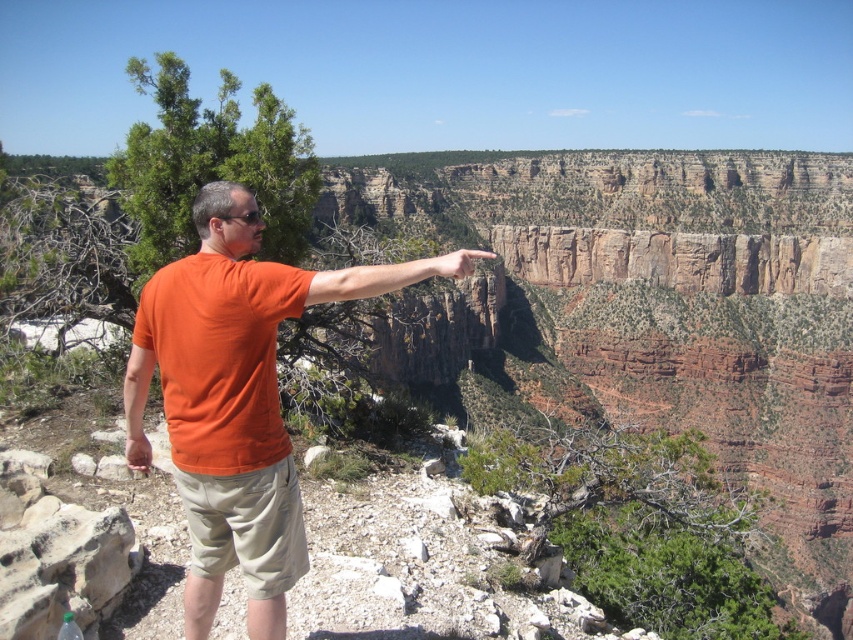
You are a photographer trying to capture the man and the canyon in a single shot. Since the orange cotton shirt at center and the matte skin hand at upper center are both in your frame, which object should you focus on first to ensure both are in focus?

You should focus on the orange cotton shirt at center first because it is closer to the viewer than the matte skin hand at upper center. By focusing on the closer object, the depth of field may help keep both in focus.

Looking at this image, you are a photographer trying to capture the man pointing at the canyon. According to the scene, where should you position your camera relative to the man to ensure both the orange cotton shirt at center and the matte skin hand at upper center are clearly visible in the shot?

Position your camera to the right of the man so that the orange cotton shirt at center is to the left of the matte skin hand at upper center, ensuring both elements are visible in the frame.

You are a photographer aiming to capture the man and the canyon in a single shot. The orange cotton shirt at center and the matte skin hand at upper center are both in your viewfinder. Which object should you focus on first if you want to ensure both are in sharp focus?

The orange cotton shirt at center is below the matte skin hand at upper center. To ensure both are in sharp focus, focus on the matte skin hand at upper center since it is farther away, as depth of field typically extends further behind the point of focus than in front.